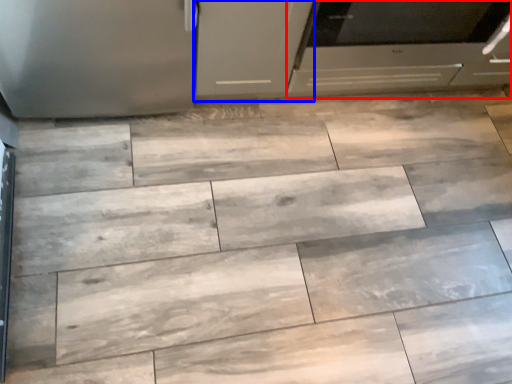
Question: Which object is closer to the camera taking this photo, oven (highlighted by a red box) or cabinetry (highlighted by a blue box)?

Choices:
 (A) oven
 (B) cabinetry

Answer: (B)